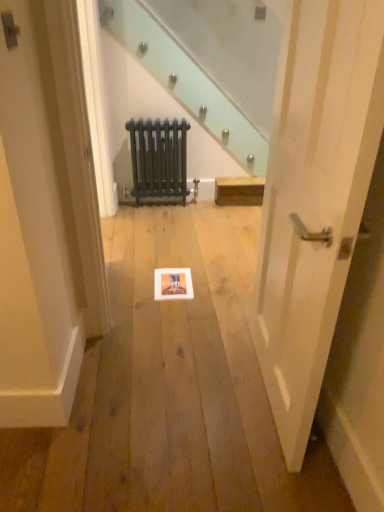
Locate an element on the screen. This screenshot has width=384, height=512. vacant area that lies to the right of matte black radiator at center is located at coordinates 201,207.